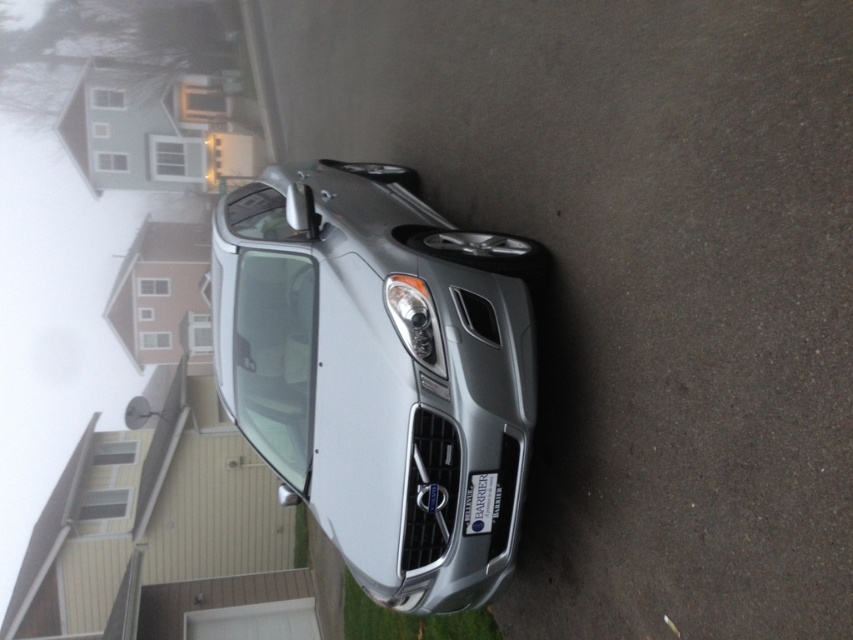
Can you confirm if silver metallic car at center is positioned to the left of black plastic license plate at lower center?

Correct, you'll find silver metallic car at center to the left of black plastic license plate at lower center.

Is silver metallic car at center positioned at the back of black plastic license plate at lower center?

No, silver metallic car at center is in front of black plastic license plate at lower center.

Identify the location of silver metallic car at center. The height and width of the screenshot is (640, 853). (636, 278).

Does point (688, 358) lie in front of point (381, 324)?

Yes.

Does silver metallic car at center appear under satin silver car at center?

Incorrect, silver metallic car at center is not positioned below satin silver car at center.

Where is `silver metallic car at center`? The image size is (853, 640). silver metallic car at center is located at coordinates (636, 278).

The width and height of the screenshot is (853, 640). I want to click on silver metallic car at center, so click(x=636, y=278).

Which of these two, satin silver car at center or black plastic license plate at lower center, stands shorter?

black plastic license plate at lower center is shorter.

Which is in front, point (334, 173) or point (469, 481)?

Point (469, 481) is more forward.

Is point (508, 307) closer to camera compared to point (466, 520)?

No, (508, 307) is further to viewer.

This screenshot has width=853, height=640. Find the location of `satin silver car at center`. satin silver car at center is located at coordinates (379, 371).